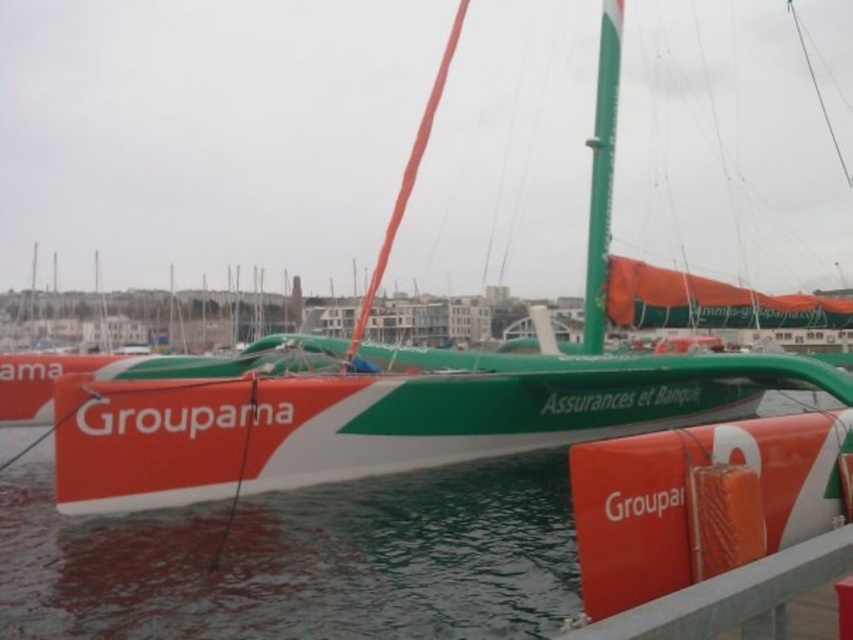
Can you confirm if green matte water at center is positioned below orange matte rail at lower right?

Yes, green matte water at center is below orange matte rail at lower right.

Can you confirm if green matte water at center is shorter than orange matte rail at lower right?

Yes, green matte water at center is shorter than orange matte rail at lower right.

Identify the location of green matte water at center. The width and height of the screenshot is (853, 640). (21, 566).